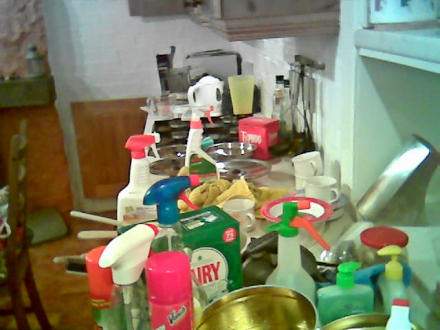
Where is `cabinet`? cabinet is located at coordinates (281, 19).